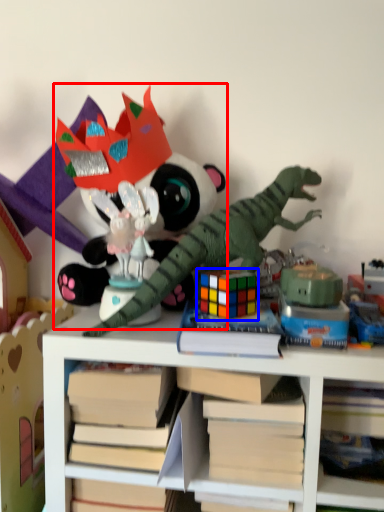
Question: Among these objects, which one is farthest to the camera, toy (highlighted by a red box) or toy (highlighted by a blue box)?

Choices:
 (A) toy
 (B) toy

Answer: (A)